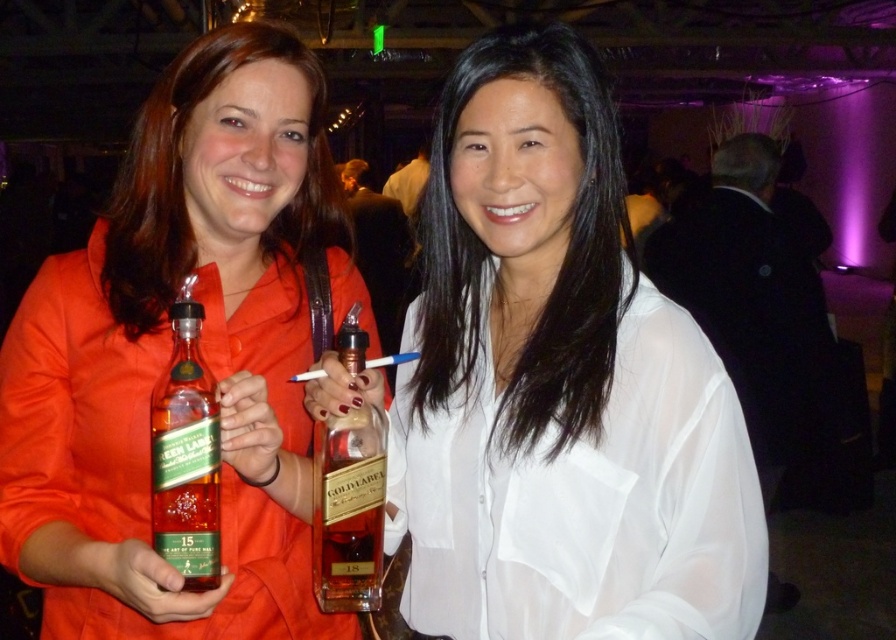
You are at a party and want to introduce yourself to the person wearing the white sheer shirt at center. Which side of the green glass bottle at center should you approach from?

You should approach from the right side of the green glass bottle at center because the white sheer shirt at center is located to the right of it.